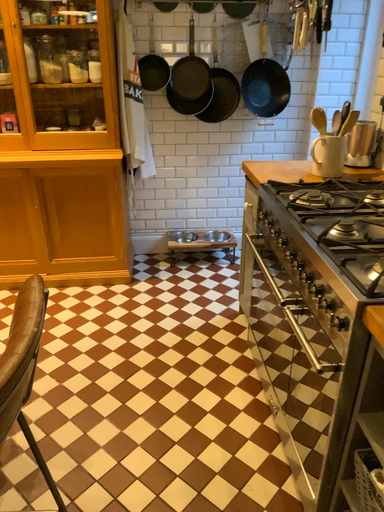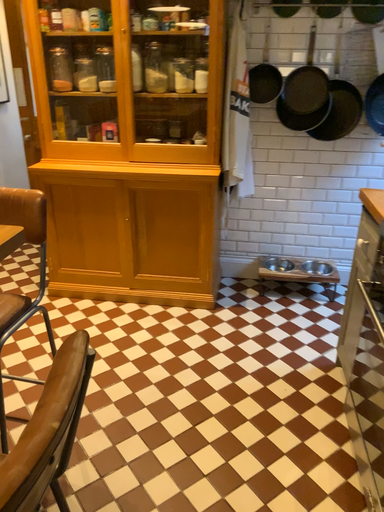
Question: Which way did the camera rotate in the video?

Choices:
 (A) rotated right
 (B) rotated left

Answer: (B)